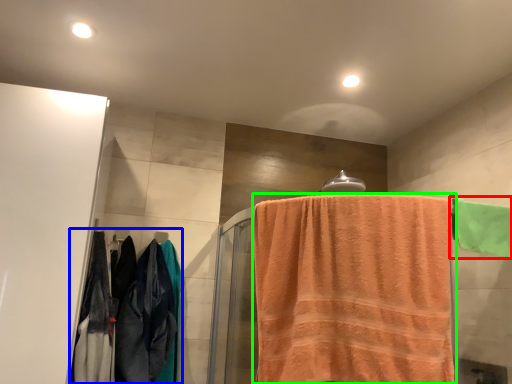
Question: Which is farther away from towel (highlighted by a red box)? clothing (highlighted by a blue box) or towel (highlighted by a green box)?

Choices:
 (A) clothing
 (B) towel

Answer: (A)